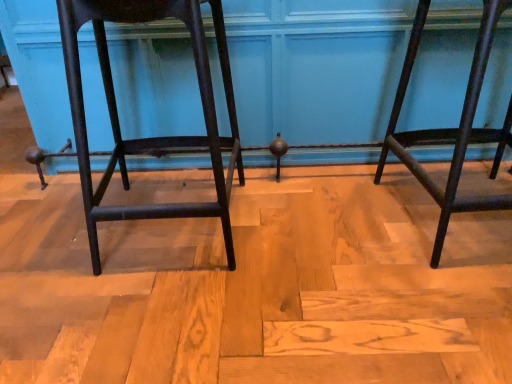
Locate an element on the screen. Image resolution: width=512 pixels, height=384 pixels. vacant space underneath matte black stool at right, positioned as the second furniture in left-to-right order (from a real-world perspective) is located at coordinates (465, 209).